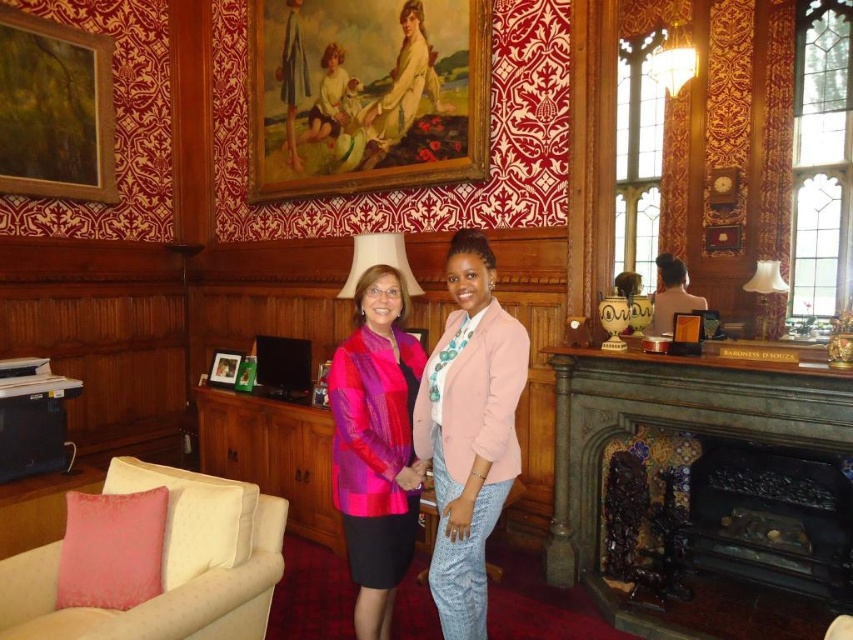
Is pink fabric jacket at center to the right of wooden picture frame at upper left from the viewer's perspective?

Correct, you'll find pink fabric jacket at center to the right of wooden picture frame at upper left.

What do you see at coordinates (469, 432) in the screenshot? The image size is (853, 640). I see `pink fabric jacket at center` at bounding box center [469, 432].

Identify the location of pink fabric jacket at center. (469, 432).

Who is more distant from viewer, (x=473, y=285) or (x=165, y=576)?

The point (x=165, y=576) is more distant.

Who is positioned more to the left, pink fabric jacket at center or velvet beige armchair at lower left?

velvet beige armchair at lower left is more to the left.

Does point (434, 422) come farther from viewer compared to point (18, 579)?

Yes, point (434, 422) is behind point (18, 579).

This screenshot has width=853, height=640. I want to click on pink fabric jacket at center, so click(469, 432).

Can you confirm if wooden picture frame at upper left is positioned to the left of white fabric lampshade at upper center?

Indeed, wooden picture frame at upper left is positioned on the left side of white fabric lampshade at upper center.

Find the location of `wooden picture frame at upper left`. wooden picture frame at upper left is located at coordinates (54, 109).